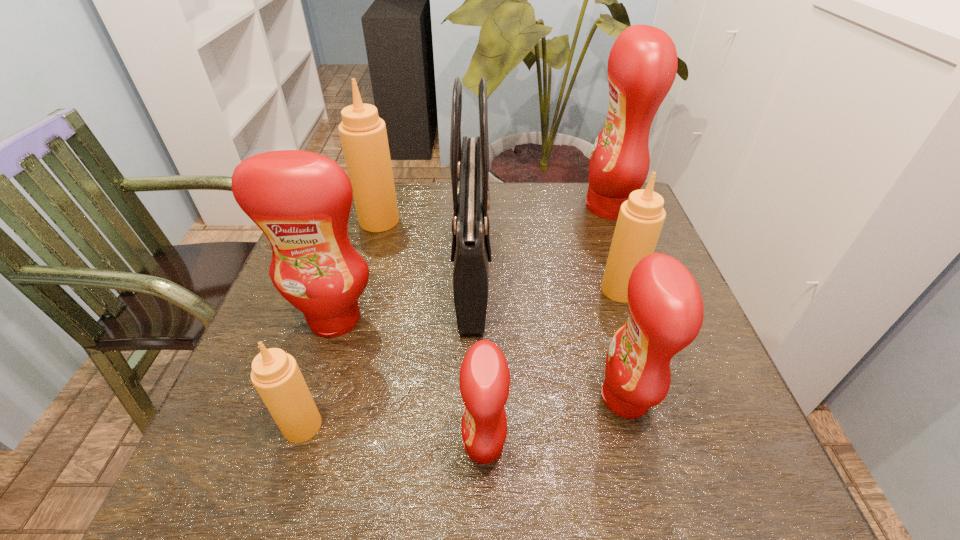
Locate an element on the screen. the farthest red condiment is located at coordinates [x=642, y=65].

I want to click on the tallest condiment, so click(x=642, y=65).

You are a GUI agent. You are given a task and a screenshot of the screen. Output one action in this format:
    pyautogui.click(x=<x>, y=<y>)
    Task: Click on the handbag
    The image size is (960, 540).
    Given the screenshot: What is the action you would take?
    coord(471,250)

At what (x,y) coordinates should I click in order to perform the action: click on the biggest tan condiment. Please return your answer as a coordinate pair (x, y). This screenshot has width=960, height=540. Looking at the image, I should click on (363, 134).

Identify the location of the third smallest red condiment. (301, 200).

Where is `the leftmost red condiment`? The width and height of the screenshot is (960, 540). the leftmost red condiment is located at coordinates (301, 200).

Where is `the second smallest tan condiment`? This screenshot has height=540, width=960. the second smallest tan condiment is located at coordinates (641, 217).

Locate an element on the screen. the rightmost tan condiment is located at coordinates (641, 217).

Locate an element on the screen. the third biggest red condiment is located at coordinates (666, 310).

The width and height of the screenshot is (960, 540). I want to click on the nearest tan condiment, so click(275, 374).